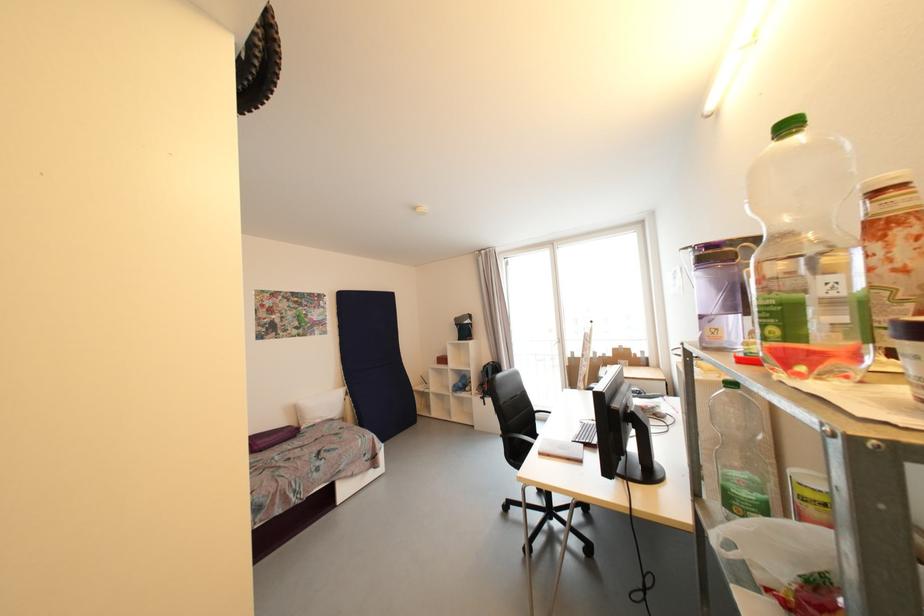
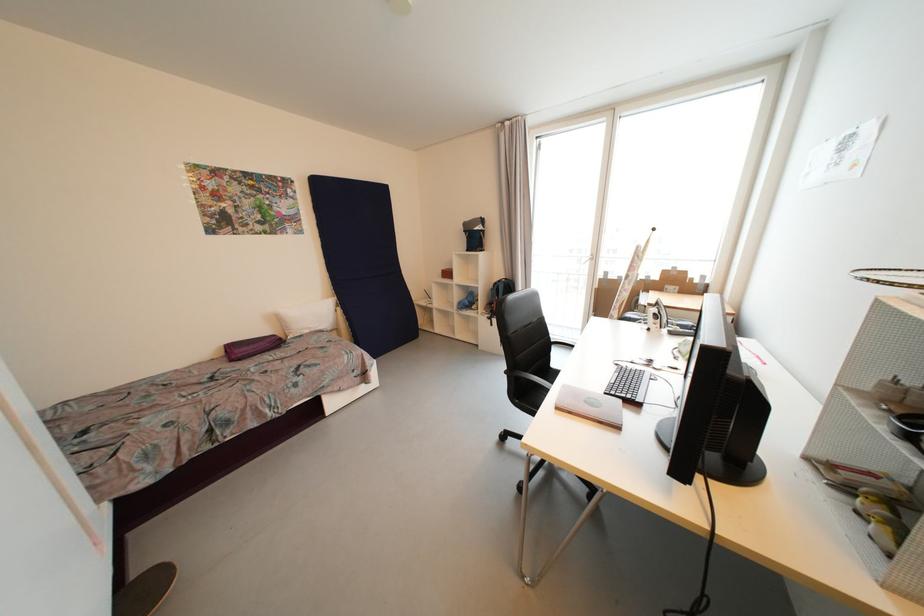
Locate, in the second image, the point that corresponds to pixel 300 411 in the first image.

(283, 321)